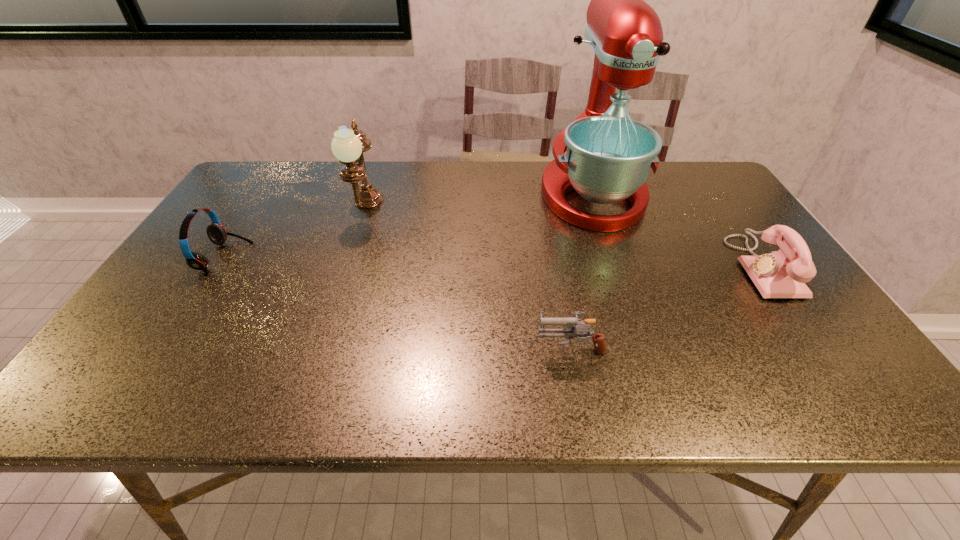
This screenshot has height=540, width=960. I want to click on vacant area between the headset and the nearest object, so click(397, 302).

I want to click on unoccupied area between the oil lamp and the leftmost object, so [x=296, y=233].

Locate an element on the screen. free space between the nearest object and the leftmost object is located at coordinates (397, 302).

Find the location of a particular element. This screenshot has height=540, width=960. vacant space that's between the headset and the oil lamp is located at coordinates (296, 233).

What are the coordinates of `vacant area between the tallest object and the rightmost object` in the screenshot? It's located at (677, 230).

Where is `vacant space that's between the telephone and the mixer`? vacant space that's between the telephone and the mixer is located at coordinates (677, 230).

Choose which object is the second nearest neighbor to the fourth shortest object. Please provide its 2D coordinates. Your answer should be formatted as a tuple, i.e. [(x, y)], where the tuple contains the x and y coordinates of a point satisfying the conditions above.

[(608, 157)]

Locate which object is the second closest to the telephone. Please provide its 2D coordinates. Your answer should be formatted as a tuple, i.e. [(x, y)], where the tuple contains the x and y coordinates of a point satisfying the conditions above.

[(570, 332)]

Locate an element on the screen. This screenshot has width=960, height=540. free space in the image that satisfies the following two spatial constraints: 1. on the front-facing side of the mixer; 2. with the microphone attached to the side of the headset is located at coordinates (614, 257).

This screenshot has width=960, height=540. I want to click on free space that satisfies the following two spatial constraints: 1. on the front-facing side of the tallest object; 2. at the barrel end of the gun, so click(645, 347).